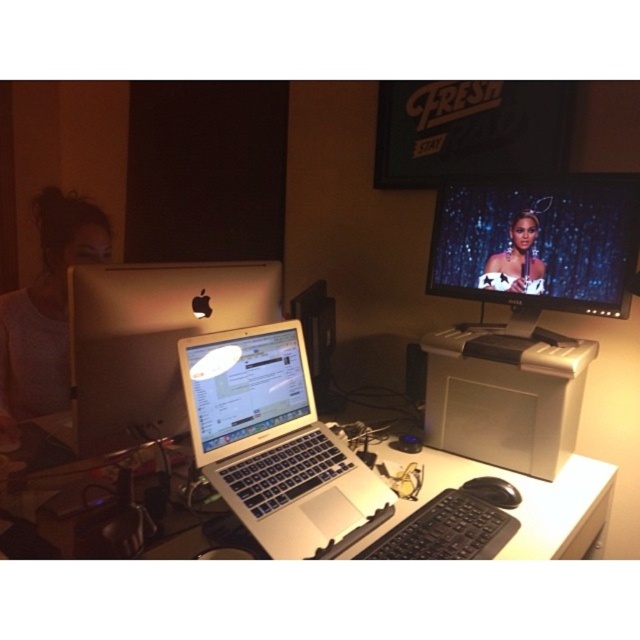
Is silver metallic laptop at center in front of sleek silver laptop at center?

Yes, it is in front of sleek silver laptop at center.

Who is taller, silver metallic laptop at center or sleek silver laptop at center?

sleek silver laptop at center is taller.

Measure the distance between point (x=362, y=512) and camera.

A distance of 3.55 feet exists between point (x=362, y=512) and camera.

What are the coordinates of `silver metallic laptop at center` in the screenshot? It's located at (275, 444).

Between matte black monitor at upper right and white plastic computer desk at center, which one is positioned lower?

Positioned lower is white plastic computer desk at center.

This screenshot has height=640, width=640. What do you see at coordinates (538, 243) in the screenshot?
I see `matte black monitor at upper right` at bounding box center [538, 243].

You are a GUI agent. You are given a task and a screenshot of the screen. Output one action in this format:
    pyautogui.click(x=<x>, y=<y>)
    Task: Click on the matte black monitor at upper right
    
    Given the screenshot: What is the action you would take?
    [538, 243]

Who is shorter, satin silver monitor at upper right or matte black monitor at upper right?

matte black monitor at upper right

Does point (426, 422) come farther from viewer compared to point (442, 282)?

No, it is not.

Where is `satin silver monitor at upper right`? satin silver monitor at upper right is located at coordinates (524, 308).

At what (x,y) coordinates should I click in order to perform the action: click on satin silver monitor at upper right. Please return your answer as a coordinate pair (x, y). Image resolution: width=640 pixels, height=640 pixels. Looking at the image, I should click on (524, 308).